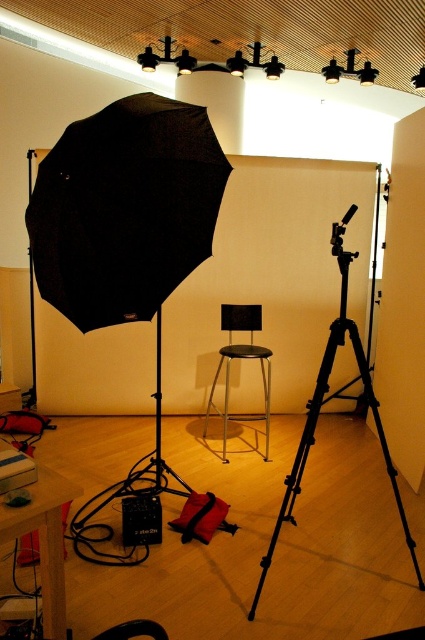
Question: Which of the following is the farthest from the observer?

Choices:
 (A) black matte umbrella at upper left
 (B) metallic stool at center

Answer: (B)

Question: Is black matte umbrella at upper left wider than black metal tripod at center?

Choices:
 (A) yes
 (B) no

Answer: (B)

Question: Considering the real-world distances, which object is closest to the black metal tripod at center?

Choices:
 (A) metallic stool at center
 (B) black matte umbrella at upper left

Answer: (B)

Question: Is black metal tripod at center positioned behind metallic stool at center?

Choices:
 (A) no
 (B) yes

Answer: (A)

Question: Which point appears farthest from the camera in this image?

Choices:
 (A) (343, 216)
 (B) (266, 390)

Answer: (B)

Question: Is black matte umbrella at upper left positioned in front of black metal tripod at center?

Choices:
 (A) yes
 (B) no

Answer: (A)